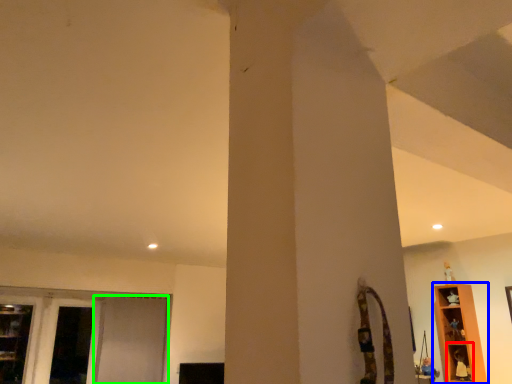
Question: Which object is positioned closest to shelf (highlighted by a red box)? Select from shelf (highlighted by a blue box) and screen door (highlighted by a green box).

Choices:
 (A) shelf
 (B) screen door

Answer: (A)